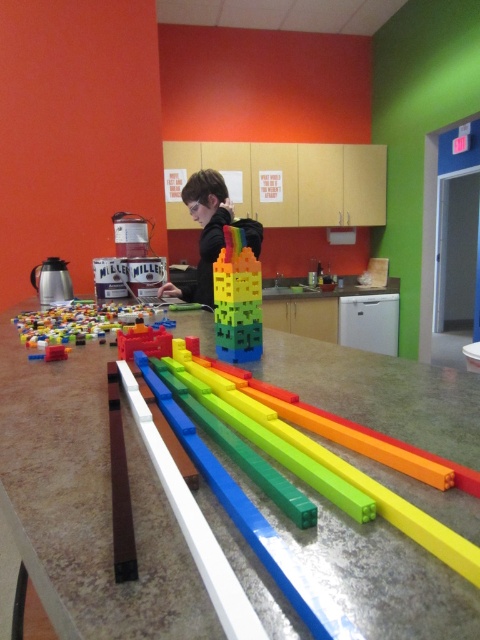
You are standing in the classroom looking at the colorful building blocks arranged on the countertop. There are two points marked on the blocks. The first point is at coordinate location (x=240, y=348) and the second is at (x=81, y=332). Which point is closer to you?

Point (x=240, y=348) is closer to the viewer than point (x=81, y=332).

You are standing in the classroom and want to reach both the point at coordinates (256,308) and the point at coordinates (207,268). Which point will you reach first?

You will reach point (256,308) first because it is closer to you than point (207,268).

You are standing at the entrance of the classroom and want to place a new object at coordinate point 0.505, 0.177. However, there are already translucent plastic blocks at lower left at that location. What should you do?

The translucent plastic blocks at lower left are already located at coordinate point (x=84, y=323), so you cannot place a new object there. You need to choose a different location.